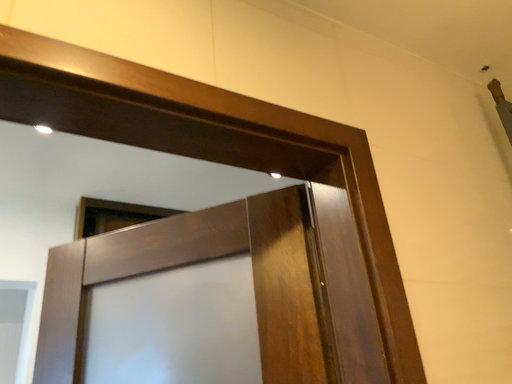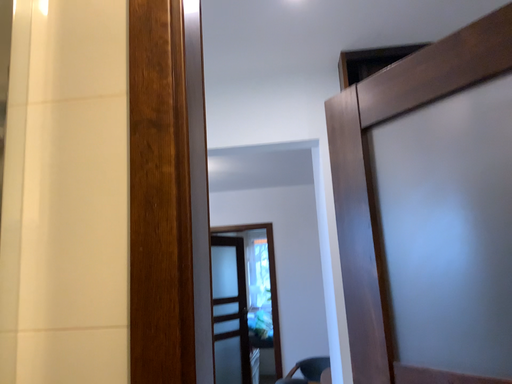
Question: How did the camera likely rotate when shooting the video?

Choices:
 (A) rotated right
 (B) rotated left

Answer: (B)